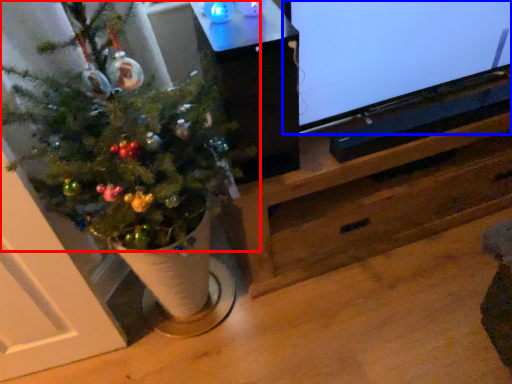
Question: Which object appears farthest to the camera in this image, christmas tree (highlighted by a red box) or television (highlighted by a blue box)?

Choices:
 (A) christmas tree
 (B) television

Answer: (B)